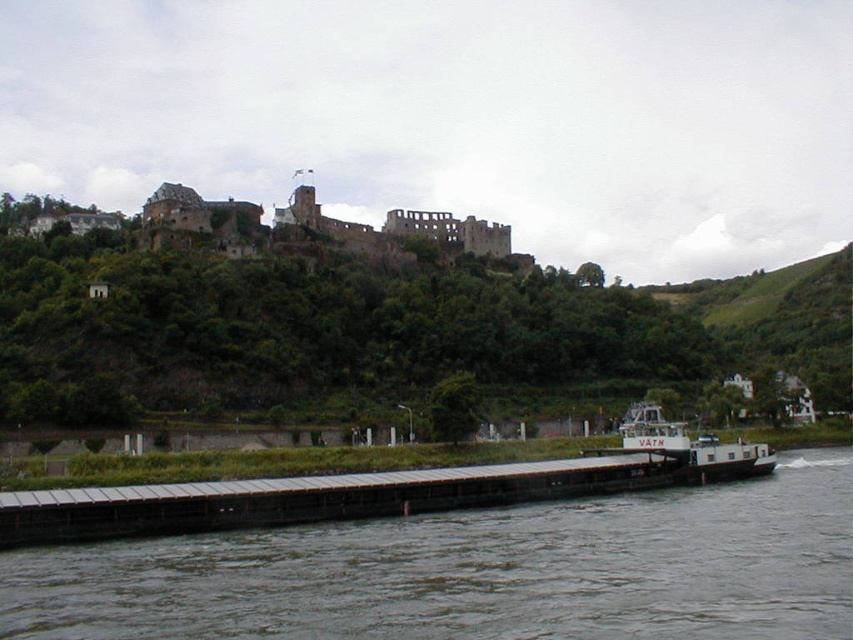
You are standing on the brown wooden dock at lower center and want to reach the metallic gray dock at lower center. Which direction should you move to get there?

The brown wooden dock at lower center is below the metallic gray dock at lower center, so you should move upward to reach the metallic gray dock at lower center.

You are standing on the brown wooden dock at lower center and want to walk to the metallic gray dock at lower center. Which direction should you face to move towards it?

Since the brown wooden dock at lower center is in front of the metallic gray dock at lower center, you should face backward to move towards the metallic gray dock at lower center.

You are standing at the very edge of the brown wooden dock at lower center. If you look straight ahead, which direction does the river flow? Please answer based on the scene description provided.

The river flows from left to right as described in the scene, so if you are standing at the edge of the brown wooden dock at lower center and look straight ahead, the river flows to your right.